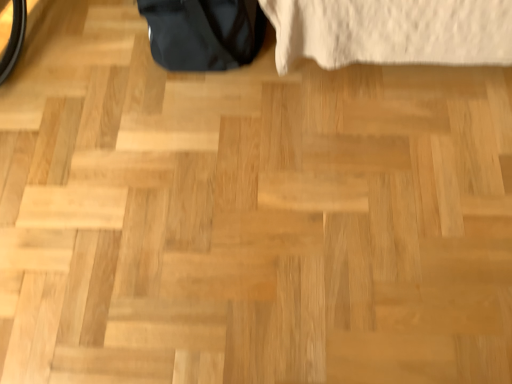
This screenshot has width=512, height=384. In order to click on vacant point to the left of glossy black bag at upper left in this screenshot , I will do `click(100, 62)`.